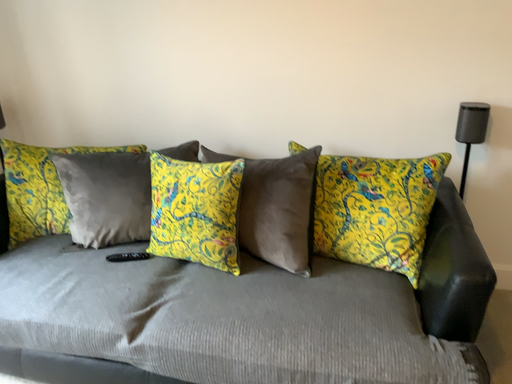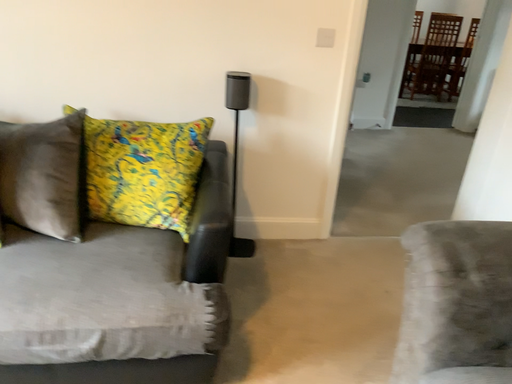
Question: Which way did the camera rotate in the video?

Choices:
 (A) rotated right
 (B) rotated left

Answer: (A)